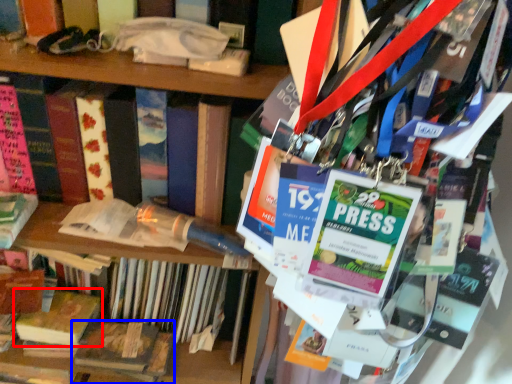
Question: Which of the following is the closest to the observer, book (highlighted by a red box) or book (highlighted by a blue box)?

Choices:
 (A) book
 (B) book

Answer: (B)